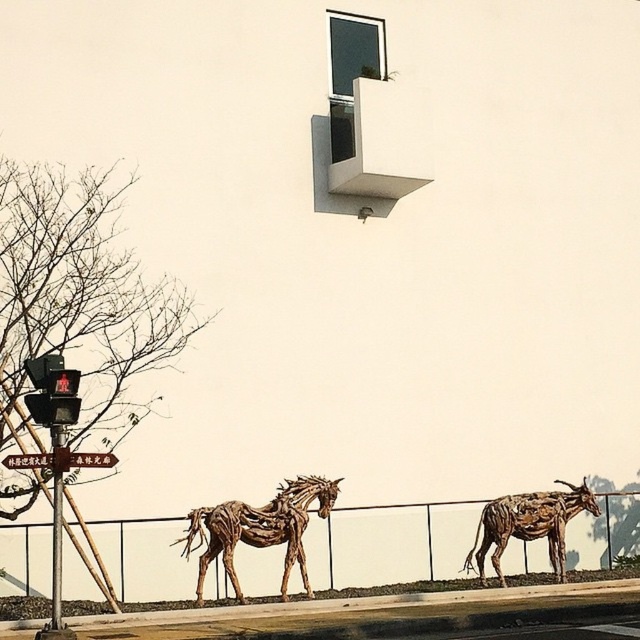
You are standing in front of the building and want to touch both the metallic wire fence at lower center and the wooden sculpture of goat at lower right. Which object should you reach for first to touch the one closer to you?

You should reach for the metallic wire fence at lower center first because it is closer to the viewer than the wooden sculpture of goat at lower right.

You are standing at the entrance of the building and see the point marked at coordinates (529, 524). What object is located at that point?

The point at coordinates (529, 524) corresponds to the wooden sculpture of goat at lower right.